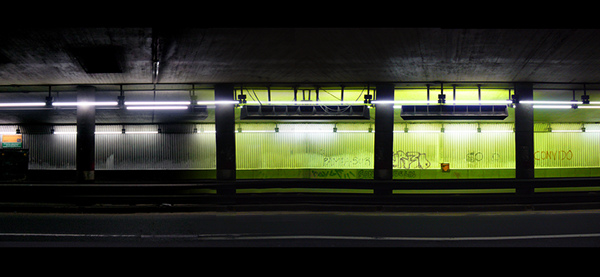
Where is `side rail`? side rail is located at coordinates (337, 188).